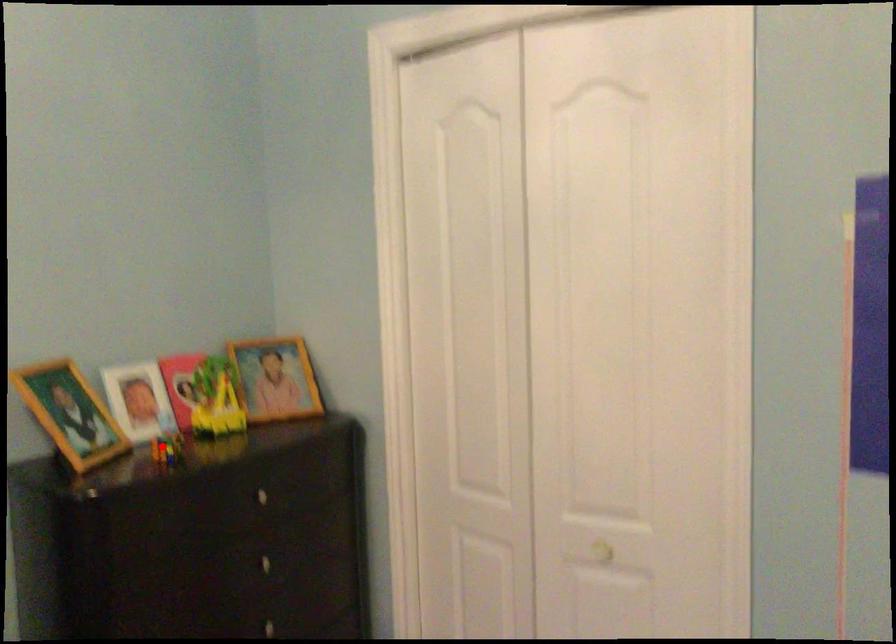
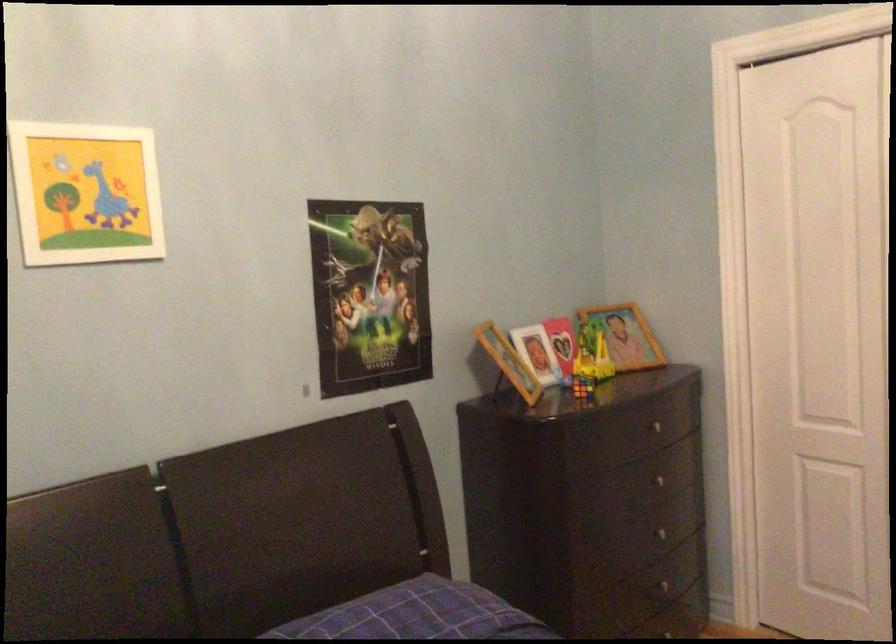
Question: I am providing you with two images of the same scene from different viewpoints. In image1, a red point is highlighted. Considering the same 3D point in image2, which of the following is correct?

Choices:
 (A) It is closer
 (B) It is farther

Answer: (B)